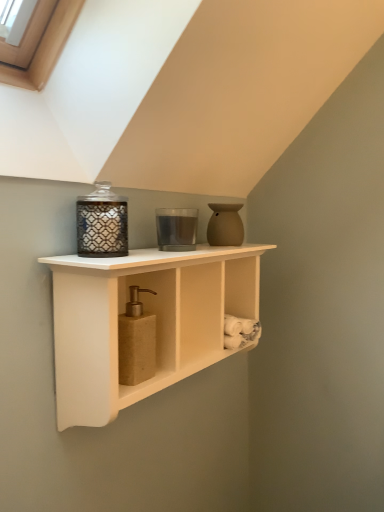
Question: Looking at their shapes, would you say translucent glass candle at center, marked as the second candle holder in a front-to-back arrangement, is wider or thinner than matte beige vase at upper right?

Choices:
 (A) thin
 (B) wide

Answer: (B)

Question: From a real-world perspective, is translucent glass candle at center, which appears as the second candle holder when viewed from the left, physically located above or below matte beige vase at upper right?

Choices:
 (A) below
 (B) above

Answer: (B)

Question: Based on their relative distances, which object is nearer to the matte glass candle holder at upper left, which is the 1th candle holder from front to back?

Choices:
 (A) matte brown soap dispenser at center
 (B) translucent glass candle at center, the first candle holder positioned from the right
 (C) white wood shelf at center
 (D) matte beige vase at upper right

Answer: (A)

Question: Which of these objects is positioned farthest from the matte brown soap dispenser at center?

Choices:
 (A) matte beige vase at upper right
 (B) white wood shelf at center
 (C) matte glass candle holder at upper left, which is the 1th candle holder from front to back
 (D) translucent glass candle at center, acting as the first candle holder starting from the back

Answer: (A)